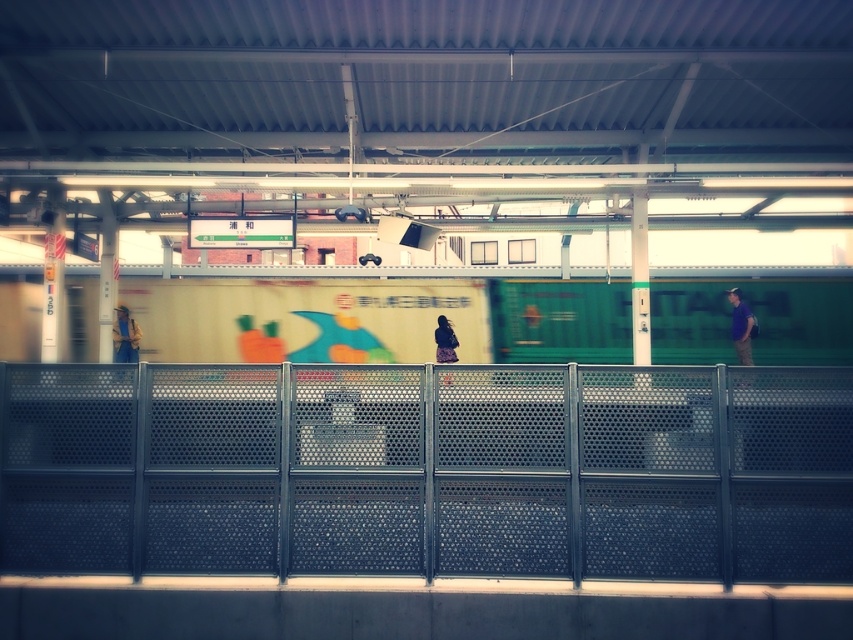
Does green matte train at center come in front of purple fabric shirt at right?

No, green matte train at center is behind purple fabric shirt at right.

In the scene shown: Does green matte train at center appear on the right side of purple fabric shirt at right?

In fact, green matte train at center is to the left of purple fabric shirt at right.

Who is more forward, (776, 282) or (751, 358)?

Point (751, 358) is more forward.

Identify the location of green matte train at center. (379, 320).

Does purple fabric shirt at right have a smaller size compared to denim jacket at left?

No.

Is purple fabric shirt at right to the right of denim jacket at left from the viewer's perspective?

Yes, purple fabric shirt at right is to the right of denim jacket at left.

Which is in front, point (741, 346) or point (137, 346)?

Positioned in front is point (741, 346).

I want to click on purple fabric shirt at right, so click(x=741, y=326).

Looking at this image, who is shorter, metallic perforated fence at center or green matte train at center?

Standing shorter between the two is metallic perforated fence at center.

Between point (312, 464) and point (183, 296), which one is positioned behind?

Point (183, 296)

Which is in front, point (169, 371) or point (476, 308)?

Positioned in front is point (169, 371).

The image size is (853, 640). I want to click on metallic perforated fence at center, so click(x=428, y=470).